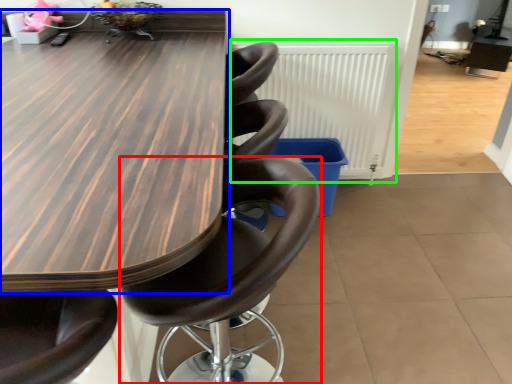
Question: Estimate the real-world distances between objects in this image. Which object is farther from chair (highlighted by a red box), table (highlighted by a blue box) or radiator (highlighted by a green box)?

Choices:
 (A) table
 (B) radiator

Answer: (B)